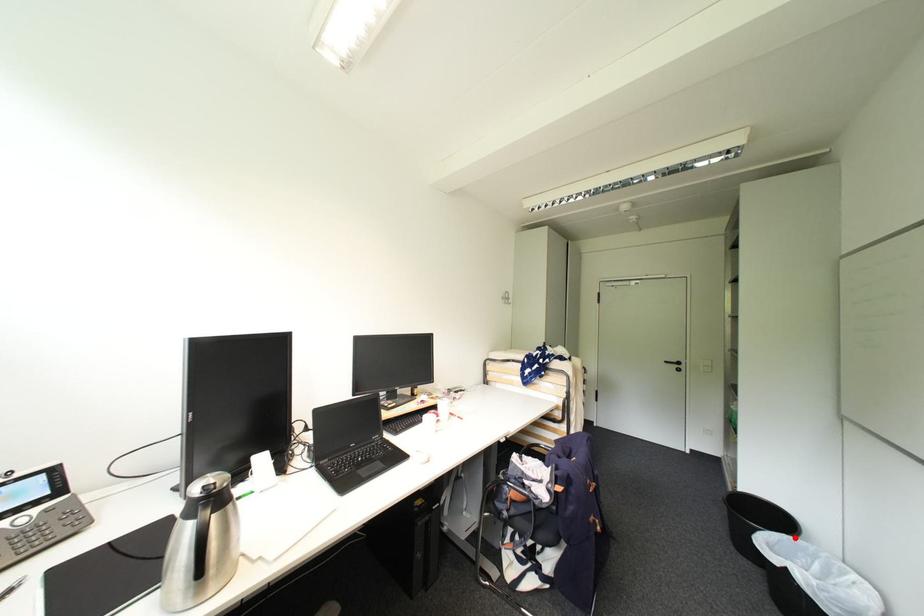
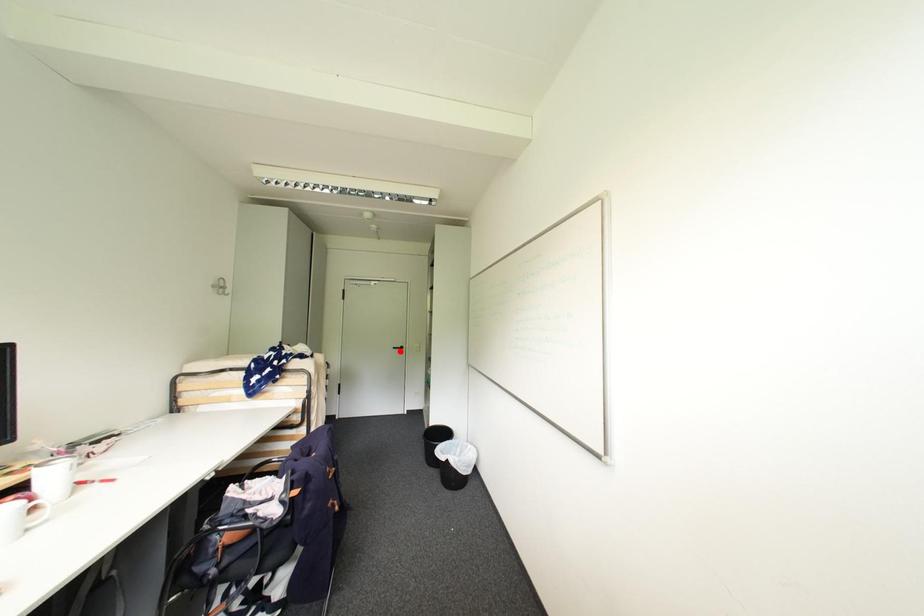
I am providing you with two images of the same scene from different viewpoints. A red point is marked on the first image and another point is marked on the second image. Is the red point in image1 aligned with the point shown in image2?

No